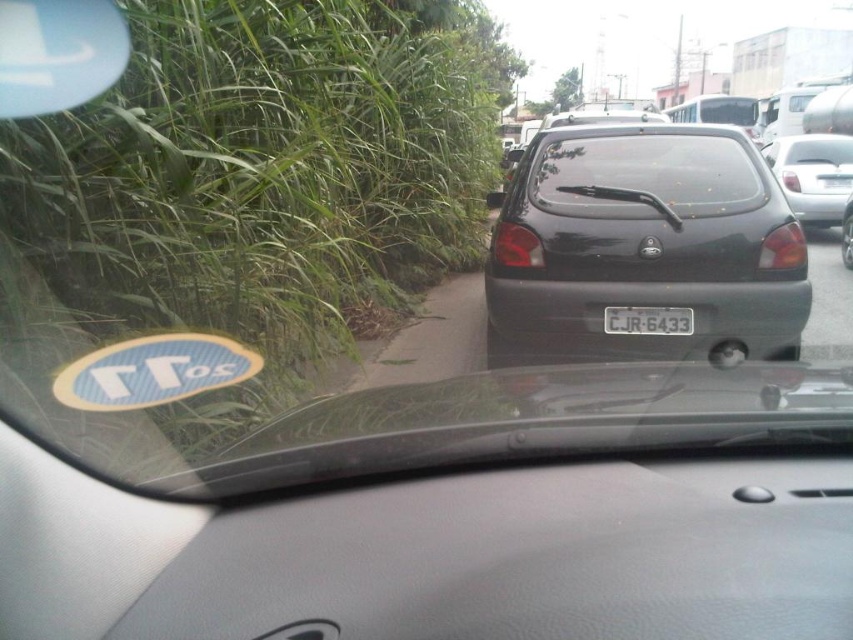
You are a driver in a vehicle and you see two points marked on the windshield. The first point is at coordinate point [587,173] and the second point is at coordinate point [811,220]. Which point is closer to your eyes?

Point [587,173] is closer to the camera than point [811,220], so the first point is closer to your eyes.

You are driving a car and want to overtake the black matte hatchback at right. Based on the scene, can you safely do so using the transparent glass windshield at center as your view?

The transparent glass windshield at center is in front of the black matte hatchback at right, meaning the hatchback is closer to you than the windshield. Since overtaking requires moving past a closer vehicle, you can safely overtake the black matte hatchback at right using the transparent glass windshield at center as your view.

You are driving a car and see the point at coordinates (646, 243) on the matte black hatchback at center. Where is this point located relative to the car you are driving?

The point at coordinates (646, 243) is on the matte black hatchback at center, which is the car you are currently driving.